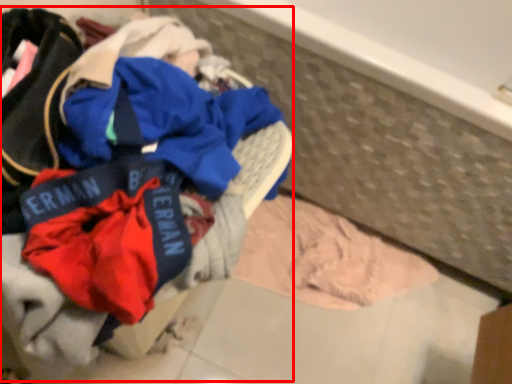
Question: From the image's perspective, what is the correct spatial positioning of laundry (annotated by the red box) in reference to baby clothe?

Choices:
 (A) above
 (B) below

Answer: (A)